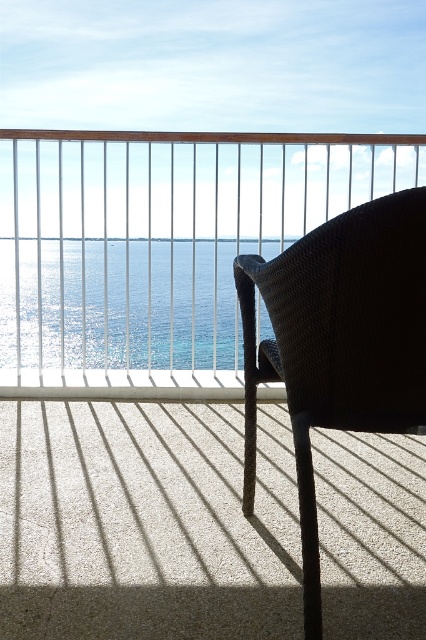
Does matte wicker chair at center come behind woven dark brown armchair at right?

Yes, it is.

Who is higher up, matte wicker chair at center or woven dark brown armchair at right?

matte wicker chair at center is above.

The image size is (426, 640). What do you see at coordinates (158, 243) in the screenshot? I see `matte wicker chair at center` at bounding box center [158, 243].

The height and width of the screenshot is (640, 426). In order to click on matte wicker chair at center in this screenshot , I will do `click(158, 243)`.

Does matte wicker chair at center have a greater width compared to shiny blue water at center?

In fact, matte wicker chair at center might be narrower than shiny blue water at center.

Between point (166, 380) and point (101, 301), which one is positioned behind?

The point (101, 301) is behind.

From the picture: Who is more distant from viewer, (204, 202) or (143, 348)?

The point (143, 348) is behind.

This screenshot has height=640, width=426. I want to click on matte wicker chair at center, so click(x=158, y=243).

Between woven dark brown armchair at right and shiny blue water at center, which one is positioned lower?

woven dark brown armchair at right is below.

Can you confirm if woven dark brown armchair at right is thinner than shiny blue water at center?

Yes, woven dark brown armchair at right is thinner than shiny blue water at center.

Is point (305, 369) positioned behind point (36, 243)?

No.

I want to click on woven dark brown armchair at right, so click(339, 342).